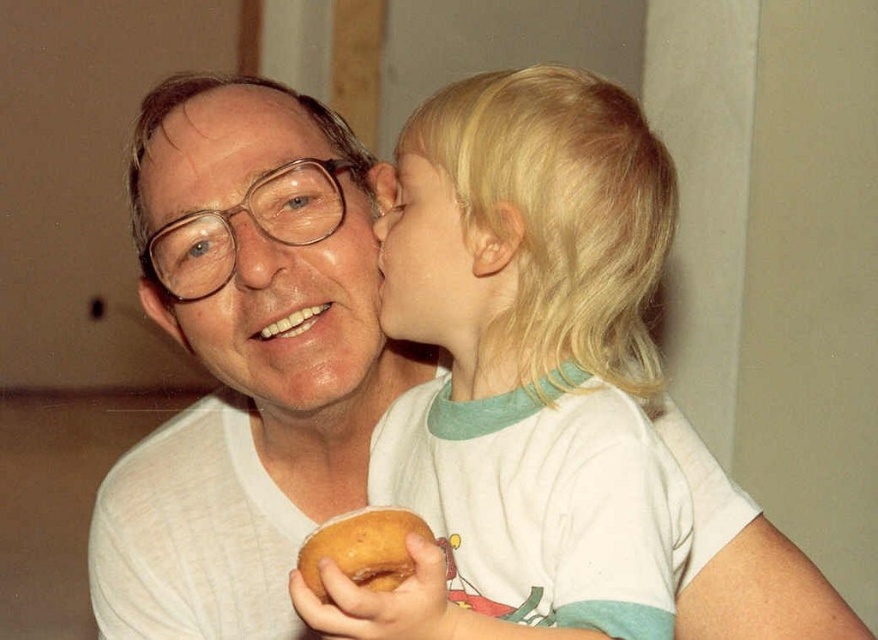
Question: Can you confirm if smooth skin face at center is smaller than golden brown bagel at lower center?

Choices:
 (A) no
 (B) yes

Answer: (A)

Question: Which point appears closest to the camera in this image?

Choices:
 (A) (392, 520)
 (B) (185, 140)
 (C) (426, 340)
 (D) (527, 564)

Answer: (A)

Question: Which of the following is the closest to the observer?

Choices:
 (A) blonde hair at upper center
 (B) smooth skin face at center
 (C) golden brown bagel at lower center

Answer: (A)

Question: Can you confirm if blonde hair at upper center is positioned below matte white face at center?

Choices:
 (A) no
 (B) yes

Answer: (B)

Question: Is blonde hair at upper center to the left of golden brown bagel at lower center from the viewer's perspective?

Choices:
 (A) yes
 (B) no

Answer: (B)

Question: Among these objects, which one is farthest from the camera?

Choices:
 (A) blonde hair at upper center
 (B) smooth skin face at center
 (C) matte white face at center

Answer: (C)